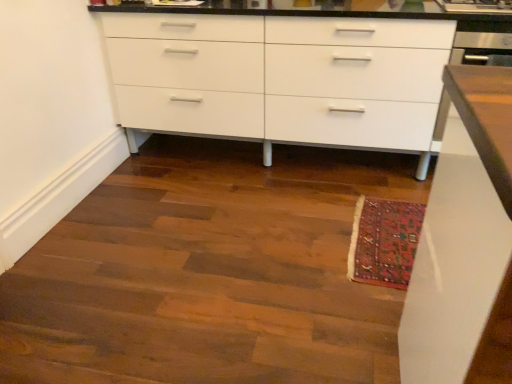
Question: Do you think wooden floor at lower center is within carpeted mat at lower right, or outside of it?

Choices:
 (A) inside
 (B) outside

Answer: (B)

Question: From the image's perspective, is wooden floor at lower center located above or below carpeted mat at lower right?

Choices:
 (A) above
 (B) below

Answer: (A)

Question: Which is farther from the carpeted mat at lower right?

Choices:
 (A) white glossy cabinet at center
 (B) wooden floor at lower center

Answer: (A)

Question: Estimate the real-world distances between objects in this image. Which object is farther from the wooden floor at lower center?

Choices:
 (A) carpeted mat at lower right
 (B) white glossy cabinet at center

Answer: (B)